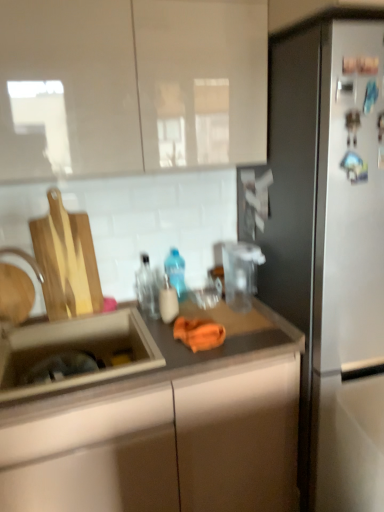
Question: Does matte plastic soap dispenser at center, marked as the first bottle in a front-to-back arrangement, have a greater height compared to brushed metal faucet at sink left?

Choices:
 (A) yes
 (B) no

Answer: (B)

Question: Can you confirm if matte plastic soap dispenser at center, marked as the first bottle in a front-to-back arrangement, is smaller than brushed metal faucet at sink left?

Choices:
 (A) no
 (B) yes

Answer: (B)

Question: Can you confirm if matte plastic soap dispenser at center, marked as the first bottle in a front-to-back arrangement, is wider than brushed metal faucet at sink left?

Choices:
 (A) no
 (B) yes

Answer: (B)

Question: Is brushed metal faucet at sink left surrounded by matte plastic soap dispenser at center, marked as the third bottle in a back-to-front arrangement?

Choices:
 (A) yes
 (B) no

Answer: (B)

Question: Can you confirm if matte plastic soap dispenser at center, marked as the first bottle in a front-to-back arrangement, is positioned to the right of brushed metal faucet at sink left?

Choices:
 (A) yes
 (B) no

Answer: (A)

Question: Is glossy white cabinet at upper center taller or shorter than transparent glass bottle at center, the second bottle when ordered from back to front?

Choices:
 (A) tall
 (B) short

Answer: (A)

Question: From a real-world perspective, is glossy white cabinet at upper center physically located above or below transparent glass bottle at center, which is the second bottle from front to back?

Choices:
 (A) above
 (B) below

Answer: (A)

Question: Relative to transparent glass bottle at center, the second bottle when ordered from back to front, is glossy white cabinet at upper center in front or behind?

Choices:
 (A) behind
 (B) front

Answer: (B)

Question: In terms of size, does glossy white cabinet at upper center appear bigger or smaller than transparent glass bottle at center, the second bottle when ordered from back to front?

Choices:
 (A) small
 (B) big

Answer: (B)

Question: In terms of width, does matte brown countertop at center look wider or thinner when compared to brushed metal faucet at sink left?

Choices:
 (A) thin
 (B) wide

Answer: (B)

Question: Considering the relative positions of matte brown countertop at center and brushed metal faucet at sink left in the image provided, is matte brown countertop at center to the left or to the right of brushed metal faucet at sink left?

Choices:
 (A) left
 (B) right

Answer: (B)

Question: From their relative heights in the image, would you say matte brown countertop at center is taller or shorter than brushed metal faucet at sink left?

Choices:
 (A) tall
 (B) short

Answer: (A)

Question: Choose the correct answer: Is matte brown countertop at center inside brushed metal faucet at sink left or outside it?

Choices:
 (A) inside
 (B) outside

Answer: (B)

Question: From the image's perspective, is stainless steel refrigerator at right positioned above or below transparent glass bottle at center, which is the second bottle from front to back?

Choices:
 (A) above
 (B) below

Answer: (B)

Question: Is stainless steel refrigerator at right spatially inside transparent glass bottle at center, the second bottle when ordered from back to front, or outside of it?

Choices:
 (A) outside
 (B) inside

Answer: (A)